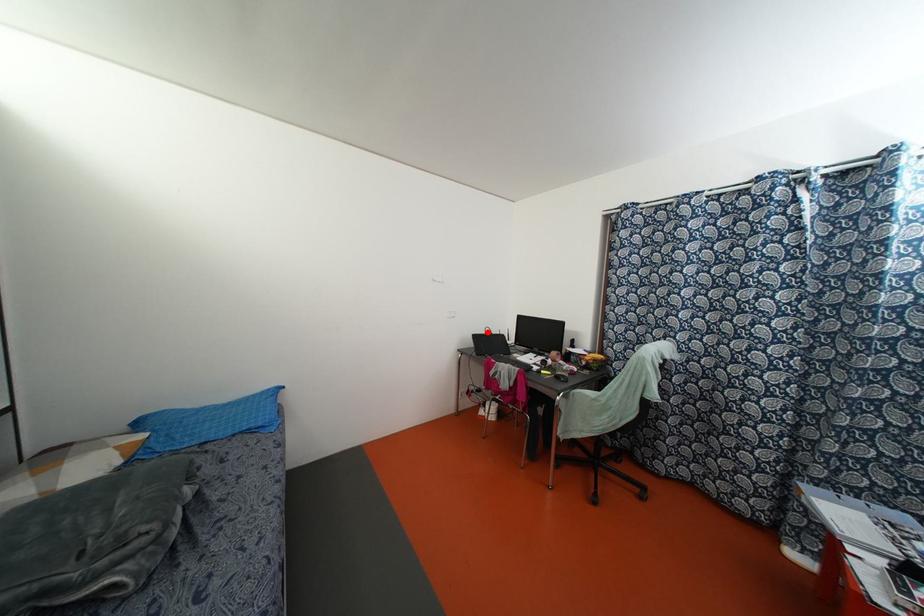
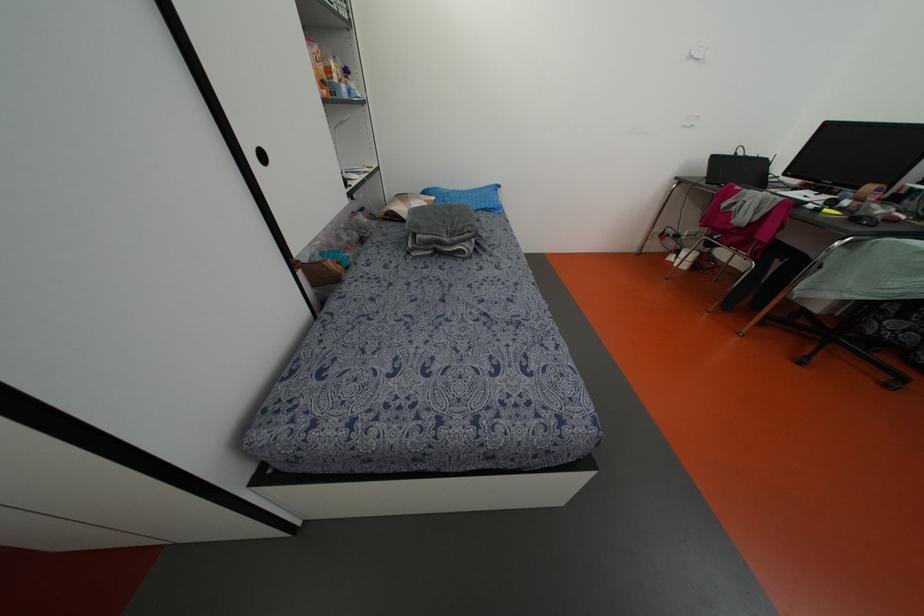
Find the pixel in the second image that matches the highlighted location in the first image.

(739, 153)